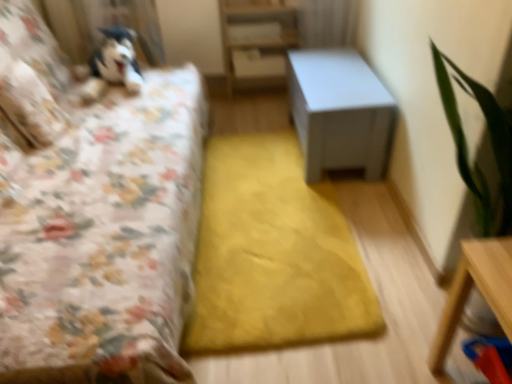
At what (x,y) coordinates should I click in order to perform the action: click on vacant space situated on the left part of white matte table at center, placed as the first table when sorted from back to front. Please return your answer as a coordinate pair (x, y). Looking at the image, I should click on (250, 147).